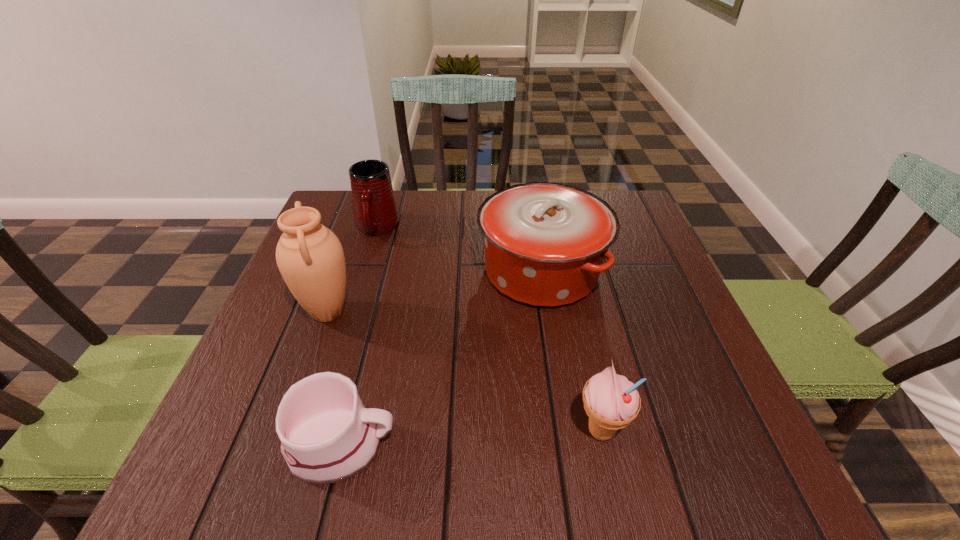
Locate an element on the screen. The width and height of the screenshot is (960, 540). vacant point located between the icecream and the farther mug is located at coordinates (489, 330).

At what (x,y) coordinates should I click in order to perform the action: click on free point between the icecream and the nearer mug. Please return your answer as a coordinate pair (x, y). Looking at the image, I should click on (470, 438).

Locate an element on the screen. The width and height of the screenshot is (960, 540). vacant space that is in between the taller mug and the nearer mug is located at coordinates (359, 337).

At what (x,y) coordinates should I click in order to perform the action: click on vacant space that's between the tallest object and the icecream. Please return your answer as a coordinate pair (x, y). Looking at the image, I should click on (465, 372).

Where is `blank region between the farther mug and the casserole`? This screenshot has height=540, width=960. blank region between the farther mug and the casserole is located at coordinates (459, 250).

Find the location of a particular element. The height and width of the screenshot is (540, 960). the third closest object to the farther mug is located at coordinates (327, 436).

Locate which object ranks third in proximity to the shortest object. Please provide its 2D coordinates. Your answer should be formatted as a tuple, i.e. [(x, y)], where the tuple contains the x and y coordinates of a point satisfying the conditions above.

[(611, 401)]

Where is `free space in the image that satisfies the following two spatial constraints: 1. on the front side of the casserole; 2. on the right side of the icecream`? The height and width of the screenshot is (540, 960). free space in the image that satisfies the following two spatial constraints: 1. on the front side of the casserole; 2. on the right side of the icecream is located at coordinates (567, 431).

Find the location of a particular element. The width and height of the screenshot is (960, 540). free space that satisfies the following two spatial constraints: 1. on the back side of the casserole; 2. on the right side of the tallest object is located at coordinates (343, 272).

Image resolution: width=960 pixels, height=540 pixels. Find the location of `free space that satisfies the following two spatial constraints: 1. on the side of the casserole with the handle; 2. on the left side of the taller mug`. free space that satisfies the following two spatial constraints: 1. on the side of the casserole with the handle; 2. on the left side of the taller mug is located at coordinates (364, 272).